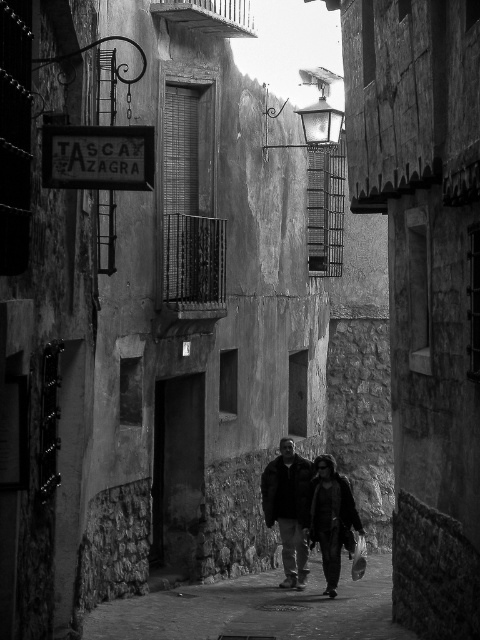
You are a delivery person holding a package that needs to be placed between the dark fabric jacket at center and the dark brown leather jacket at center. The package is 10 inches long. Can you fit it between them?

The distance between the dark fabric jacket at center and the dark brown leather jacket at center is 9.20 inches. Since the package is 10 inches long, it cannot fit between them as the space is smaller than the package.